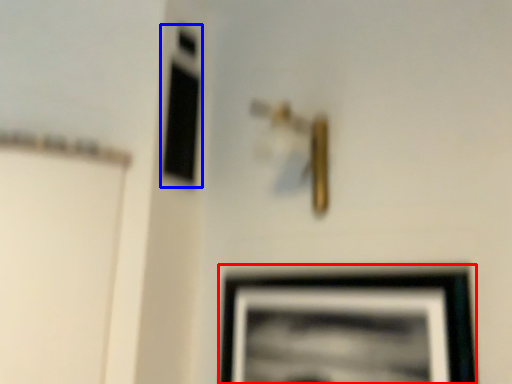
Question: Among these objects, which one is nearest to the camera, picture frame (highlighted by a red box) or window (highlighted by a blue box)?

Choices:
 (A) picture frame
 (B) window

Answer: (A)